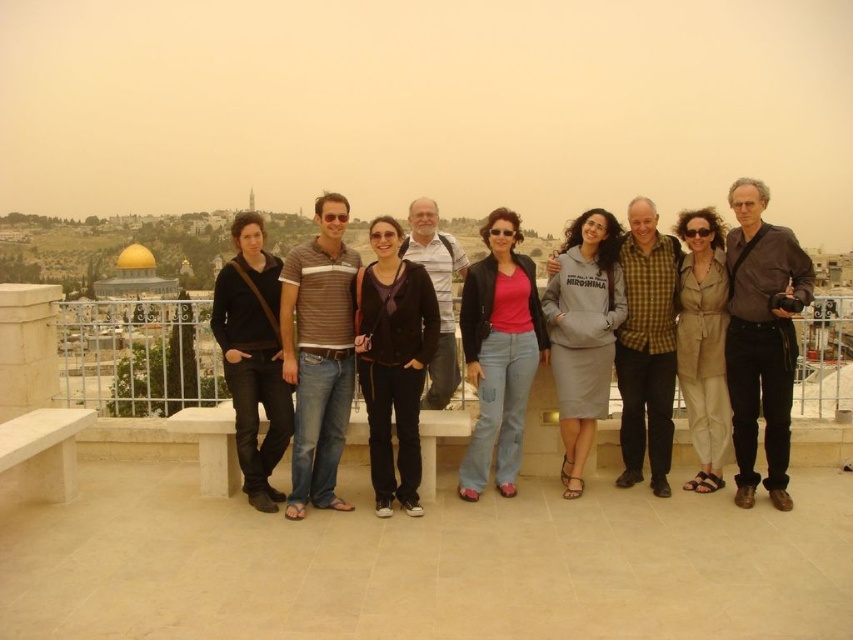
Question: Which point is closer to the camera?

Choices:
 (A) beige fabric dress at center-right
 (B) matte black jacket at center
 (C) pink matte shirt at center

Answer: (B)

Question: Is striped polo shirt at center bigger than black matte jacket at center?

Choices:
 (A) no
 (B) yes

Answer: (B)

Question: Which of the following is the farthest from the observer?

Choices:
 (A) pink matte shirt at center
 (B) striped polo shirt at center
 (C) dark gray shirt at center

Answer: (A)

Question: Is dark gray shirt at center above beige fabric dress at center-right?

Choices:
 (A) no
 (B) yes

Answer: (B)

Question: Is matte black jacket at center further to camera compared to beige fabric dress at center-right?

Choices:
 (A) yes
 (B) no

Answer: (B)

Question: Based on their relative distances, which object is farther from the beige fabric dress at center-right?

Choices:
 (A) dark gray shirt at center
 (B) striped polo shirt at center
 (C) matte black jacket at center
 (D) pink matte shirt at center

Answer: (B)